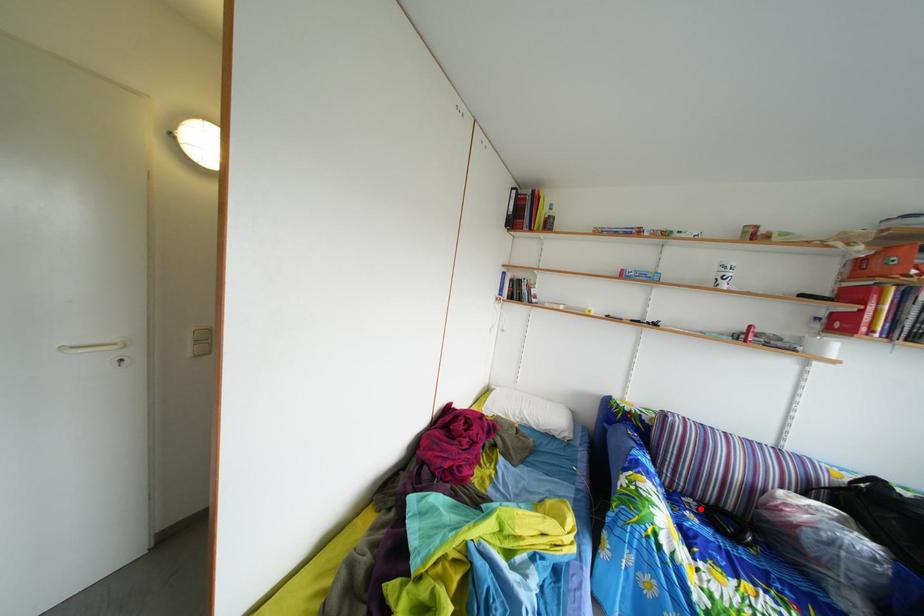
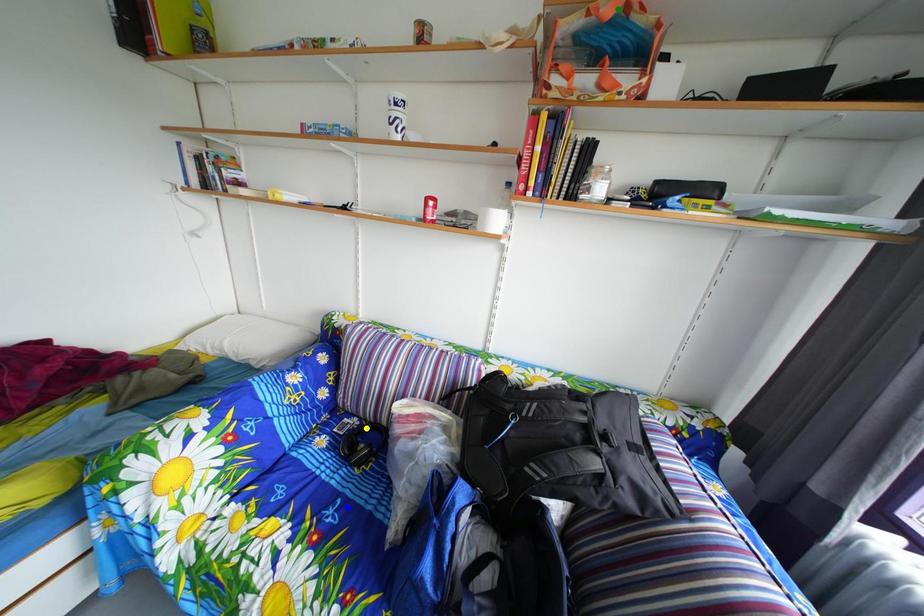
Question: I am providing you with two images of the same scene from different viewpoints. A red point is marked on the first image. You are given multiple points on the second image. Which point in image 2 represents the same 3d spot as the red point in image 1?

Choices:
 (A) blue point
 (B) green point
 (C) yellow point

Answer: (C)